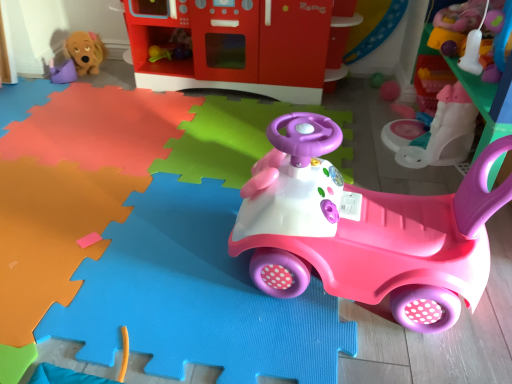
I want to click on free point to the right of matte purple toy at upper left, which is the sixth toy in right-to-left order, so click(x=95, y=82).